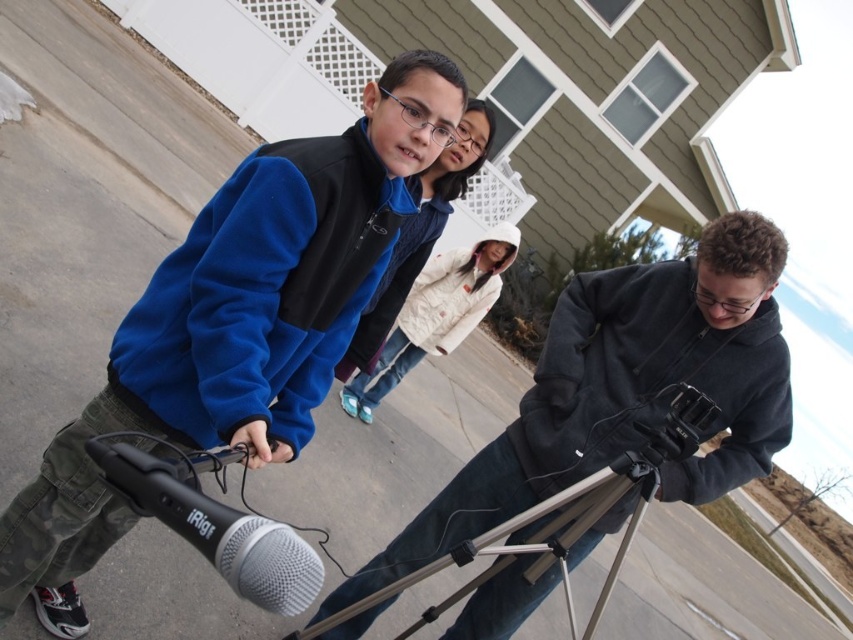
Between point (479, 577) and point (258, 532), which one is positioned in front?

Point (258, 532) is in front.

Does silver metallic tripod at center have a smaller size compared to silver/metallic microphone at lower left?

Incorrect, silver metallic tripod at center is not smaller in size than silver/metallic microphone at lower left.

Where is `silver metallic tripod at center`? The height and width of the screenshot is (640, 853). silver metallic tripod at center is located at coordinates (491, 552).

Locate an element on the screen. silver metallic tripod at center is located at coordinates (491, 552).

Is point (723, 291) positioned in front of point (422, 308)?

Yes, point (723, 291) is in front of point (422, 308).

In the scene shown: Measure the distance between dark gray hoodie at center and white cotton jacket at center.

6.21 feet

Between point (500, 618) and point (500, 262), which one is positioned in front?

Point (500, 618) is more forward.

Locate an element on the screen. dark gray hoodie at center is located at coordinates (625, 392).

Is dark gray hoodie at center closer to camera compared to black fleece sweatshirt at lower right?

Yes, it is.

Is dark gray hoodie at center further to the viewer compared to black fleece sweatshirt at lower right?

That is False.

The width and height of the screenshot is (853, 640). In order to click on dark gray hoodie at center in this screenshot , I will do `click(625, 392)`.

Image resolution: width=853 pixels, height=640 pixels. Find the location of `dark gray hoodie at center`. dark gray hoodie at center is located at coordinates pyautogui.click(x=625, y=392).